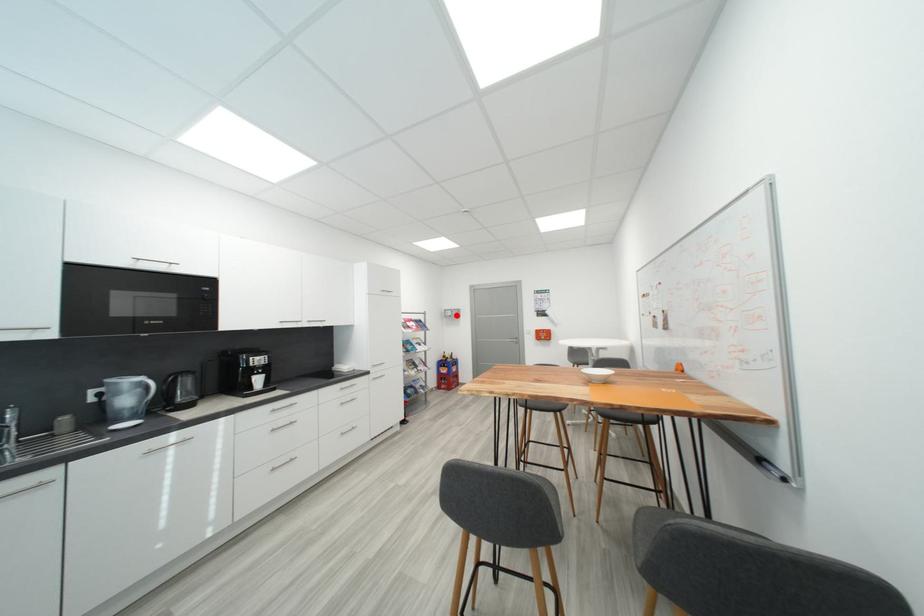
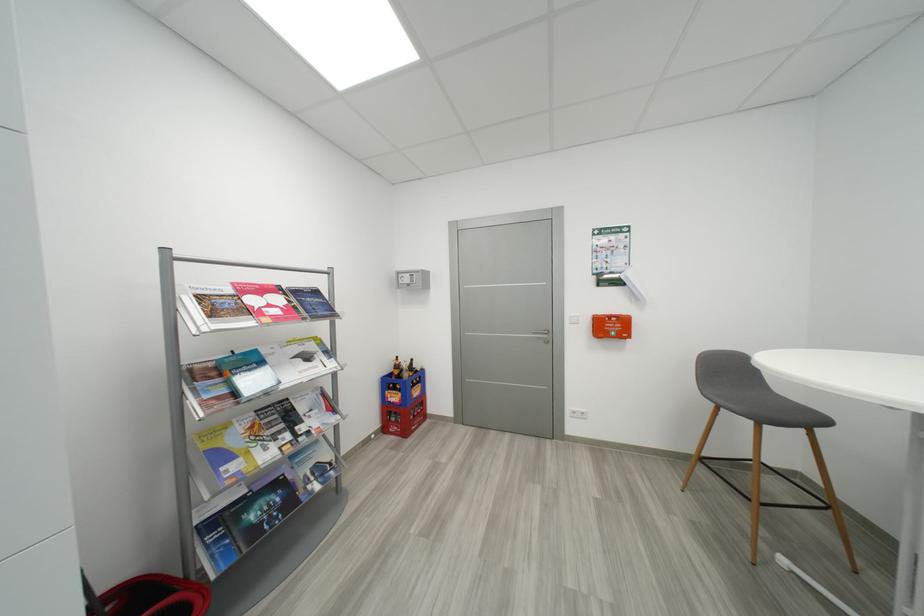
The point at the highlighted location is marked in the first image. Where is the corresponding point in the second image?

(412, 282)